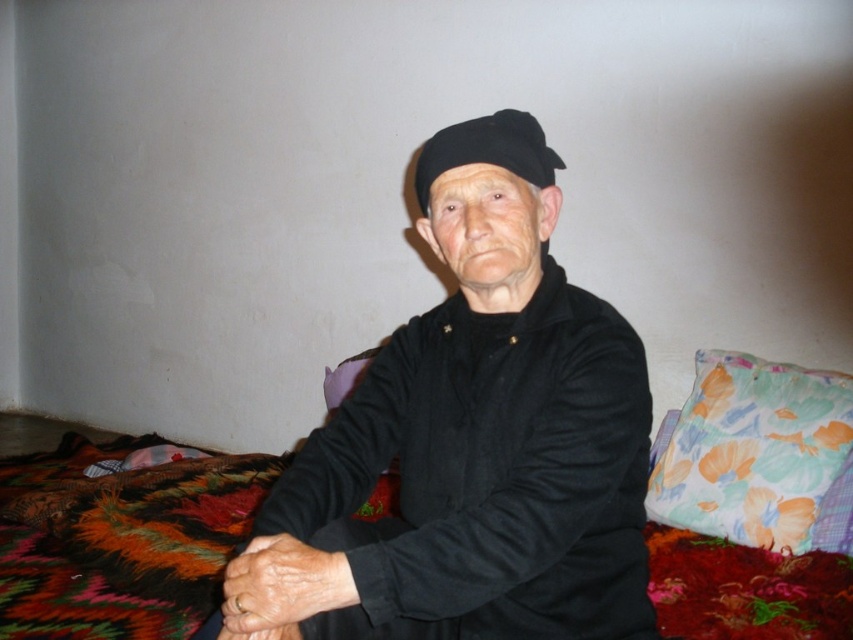
You are an interior designer assessing the layout of this living space. You notice the black fabric hat at center and the floral fabric pillow at lower right. Which object is positioned closer to the viewer?

The floral fabric pillow at lower right is closer to the viewer since the black fabric hat at center is positioned behind it.

Where is the black matte jacket at center located in the image?

The black matte jacket at center is located at point [473,442] in the image.

Consider the image. You are an interior designer assessing the layout of this living space. The elderly individual is seated on a chair. Where is the floral fabric pillow at lower right positioned relative to the chair?

The floral fabric pillow at lower right is positioned at point (757, 456) relative to the chair, which places it at the lower right area of the scene.